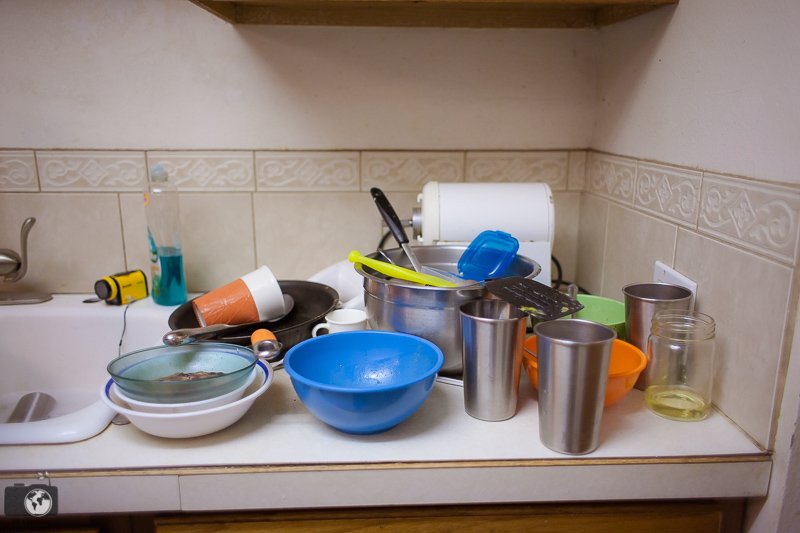
Locate an element on the screen. The image size is (800, 533). countertop is located at coordinates (460, 444).